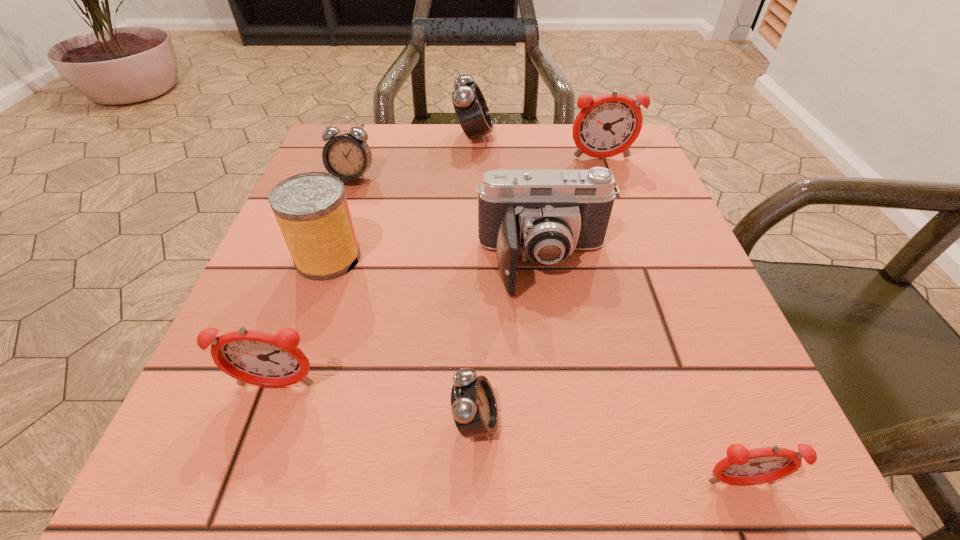
The height and width of the screenshot is (540, 960). Find the location of `free space between the leftmost white alarm clock and the biggest reddish-pink alarm clock`. free space between the leftmost white alarm clock and the biggest reddish-pink alarm clock is located at coordinates (477, 168).

Identify which object is located as the fourth nearest to the nearest object. Please provide its 2D coordinates. Your answer should be formatted as a tuple, i.e. [(x, y)], where the tuple contains the x and y coordinates of a point satisfying the conditions above.

[(311, 209)]

Identify the location of object that stands as the sixth closest to the leftmost white alarm clock. (474, 408).

Point out which alarm clock is positioned as the third nearest to the second biggest reddish-pink alarm clock. Please provide its 2D coordinates. Your answer should be formatted as a tuple, i.e. [(x, y)], where the tuple contains the x and y coordinates of a point satisfying the conditions above.

[(741, 466)]

Identify the location of the sixth closest alarm clock to the can. (741, 466).

You are a GUI agent. You are given a task and a screenshot of the screen. Output one action in this format:
    pyautogui.click(x=<x>, y=<y>)
    Task: Click on the third closest white alarm clock to the farthest reddish-pink alarm clock
    This screenshot has width=960, height=540.
    Given the screenshot: What is the action you would take?
    point(474,408)

You are a GUI agent. You are given a task and a screenshot of the screen. Output one action in this format:
    pyautogui.click(x=<x>, y=<y>)
    Task: Click on the white alarm clock object that ranks as the second closest to the farthest object
    The image size is (960, 540).
    Given the screenshot: What is the action you would take?
    pyautogui.click(x=474, y=408)

This screenshot has width=960, height=540. What are the coordinates of `reddish-pink alarm clock object that ranks as the third closest to the camera` in the screenshot? It's located at (741, 466).

Locate an element on the screen. This screenshot has height=540, width=960. reddish-pink alarm clock that is the closest to the camera is located at coordinates (608, 125).

Image resolution: width=960 pixels, height=540 pixels. Identify the location of vacant space that satisfies the following two spatial constraints: 1. on the face of the biggest white alarm clock; 2. on the face of the leftmost white alarm clock. (472, 178).